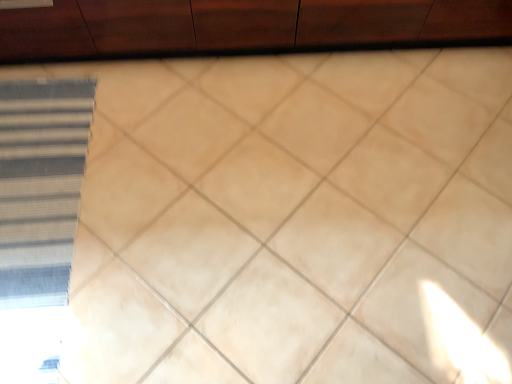
Question: Should I look upward or downward to see textured beige curtain at left?

Choices:
 (A) down
 (B) up

Answer: (A)